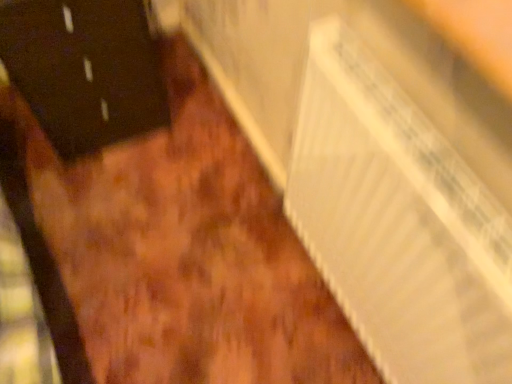
Question: From a real-world perspective, is white cardboard radiator at lower right located beneath black matte door at left?

Choices:
 (A) no
 (B) yes

Answer: (A)

Question: Considering the relative sizes of white cardboard radiator at lower right and black matte door at left in the image provided, is white cardboard radiator at lower right taller than black matte door at left?

Choices:
 (A) yes
 (B) no

Answer: (B)

Question: From the image's perspective, would you say white cardboard radiator at lower right is shown under black matte door at left?

Choices:
 (A) no
 (B) yes

Answer: (B)

Question: Is black matte door at left surrounded by white cardboard radiator at lower right?

Choices:
 (A) yes
 (B) no

Answer: (B)

Question: Is white cardboard radiator at lower right far from black matte door at left?

Choices:
 (A) no
 (B) yes

Answer: (A)

Question: Can you confirm if white cardboard radiator at lower right is bigger than black matte door at left?

Choices:
 (A) no
 (B) yes

Answer: (A)

Question: From a real-world perspective, is black matte door at left on white cardboard radiator at lower right?

Choices:
 (A) no
 (B) yes

Answer: (A)

Question: Can you confirm if black matte door at left is positioned to the right of white cardboard radiator at lower right?

Choices:
 (A) no
 (B) yes

Answer: (A)

Question: Considering the relative sizes of black matte door at left and white cardboard radiator at lower right in the image provided, is black matte door at left shorter than white cardboard radiator at lower right?

Choices:
 (A) yes
 (B) no

Answer: (B)

Question: Is black matte door at left aimed at white cardboard radiator at lower right?

Choices:
 (A) yes
 (B) no

Answer: (A)

Question: Is there a large distance between black matte door at left and white cardboard radiator at lower right?

Choices:
 (A) no
 (B) yes

Answer: (A)

Question: Does black matte door at left lie behind white cardboard radiator at lower right?

Choices:
 (A) yes
 (B) no

Answer: (A)

Question: Is point (362, 235) closer or farther from the camera than point (42, 89)?

Choices:
 (A) farther
 (B) closer

Answer: (B)